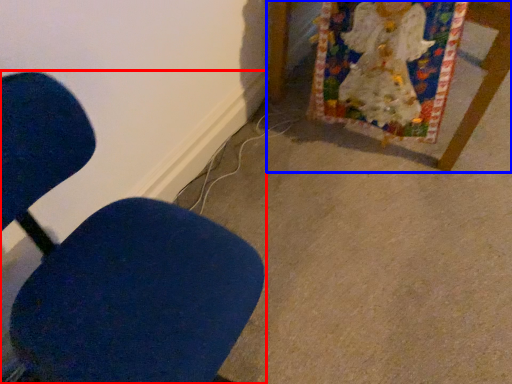
Question: Which object appears closest to the camera in this image, chair (highlighted by a red box) or furniture (highlighted by a blue box)?

Choices:
 (A) chair
 (B) furniture

Answer: (A)